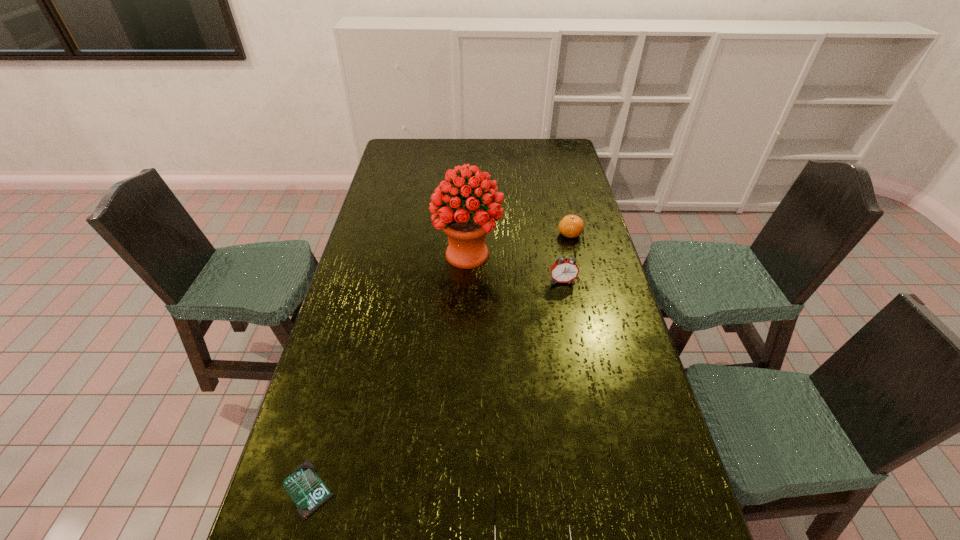
Identify the location of free point between the alarm clock and the bouquet. [515, 268].

Identify the location of blank region between the alarm clock and the tallest object. (515, 268).

This screenshot has width=960, height=540. Find the location of `vacant space in between the alarm clock and the third shortest object`. vacant space in between the alarm clock and the third shortest object is located at coordinates (566, 258).

Where is `vacant area between the tallest object and the alarm clock`? This screenshot has height=540, width=960. vacant area between the tallest object and the alarm clock is located at coordinates (515, 268).

Identify the location of vacant area that lies between the tallest object and the clementine. This screenshot has width=960, height=540. (518, 244).

Identify which object is the second closest to the bouquet. Please provide its 2D coordinates. Your answer should be formatted as a tuple, i.e. [(x, y)], where the tuple contains the x and y coordinates of a point satisfying the conditions above.

[(571, 226)]

Locate which object is the third closest to the bouquet. Please provide its 2D coordinates. Your answer should be formatted as a tuple, i.e. [(x, y)], where the tuple contains the x and y coordinates of a point satisfying the conditions above.

[(304, 486)]